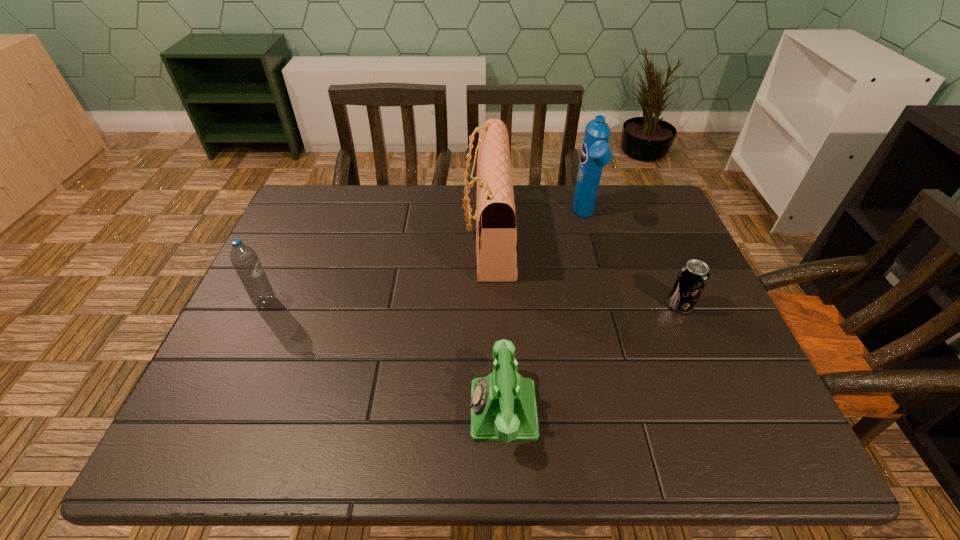
You are a GUI agent. You are given a task and a screenshot of the screen. Output one action in this format:
    pyautogui.click(x=<x>, y=<y>)
    Task: Click on the second object from right to left
    
    Given the screenshot: What is the action you would take?
    pos(596,153)

What are the coordinates of `handbag` in the screenshot? It's located at (496, 236).

What are the coordinates of `water bottle` in the screenshot? It's located at (244, 259).

Identify the location of the leftmost object. (244, 259).

Find the location of a particular element. The width and height of the screenshot is (960, 540). soda can is located at coordinates click(693, 275).

Identify the location of the nearest object. (503, 407).

At what (x,y) coordinates should I click in order to perform the action: click on vacant point located 0.190m on the right of the second object from right to left. Please return your answer as a coordinate pair (x, y). Looking at the image, I should click on (660, 217).

The width and height of the screenshot is (960, 540). I want to click on free space located on the front-facing side of the second tallest object, so click(421, 233).

I want to click on free space located 0.310m on the front-facing side of the second tallest object, so click(354, 233).

Identify the location of free space located 0.220m on the front-facing side of the second tallest object. This screenshot has width=960, height=540. (386, 233).